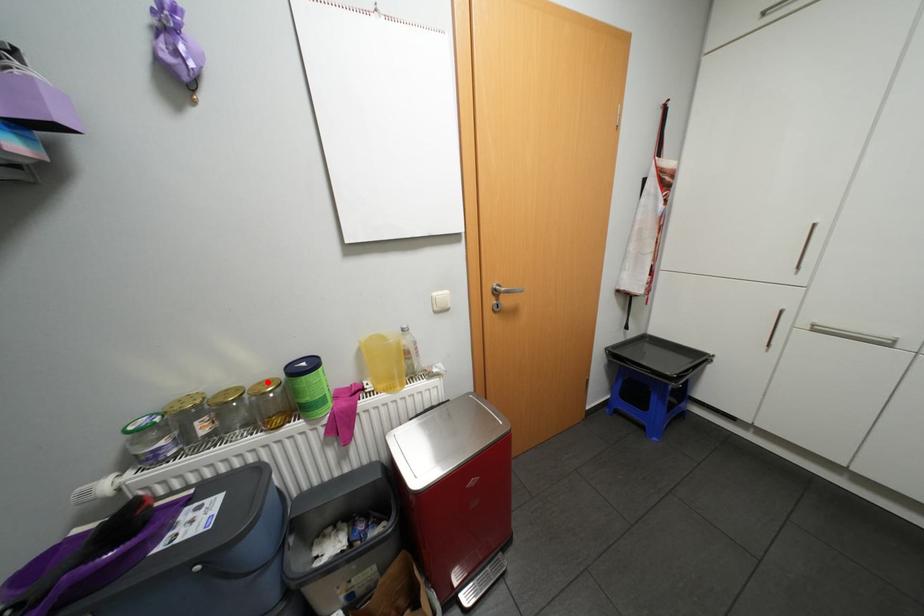
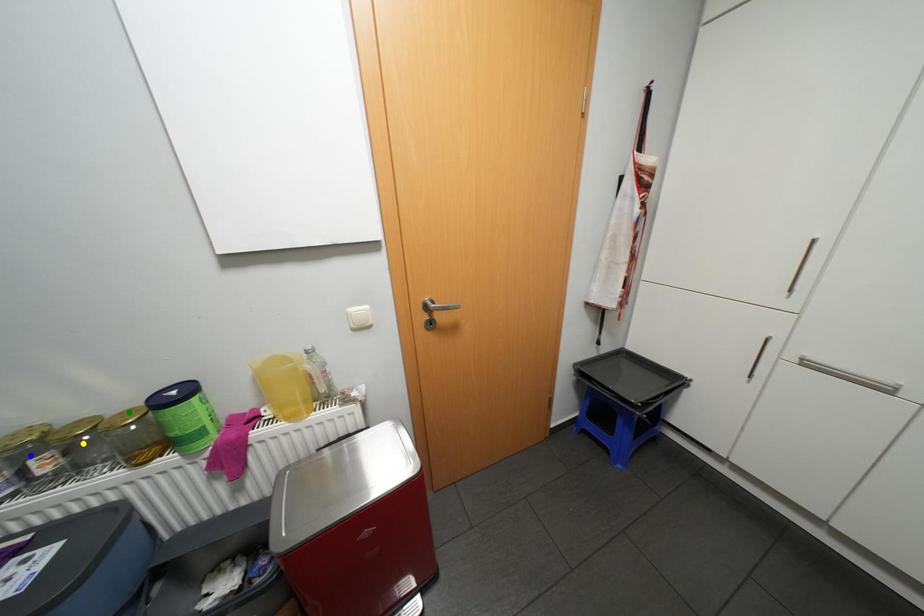
Question: I am providing you with two images of the same scene from different viewpoints. A red point is marked on the first image. You are given multiple points on the second image. Which spot in image 2 lines up with the point in image 1?

Choices:
 (A) blue point
 (B) green point
 (C) yellow point

Answer: (B)